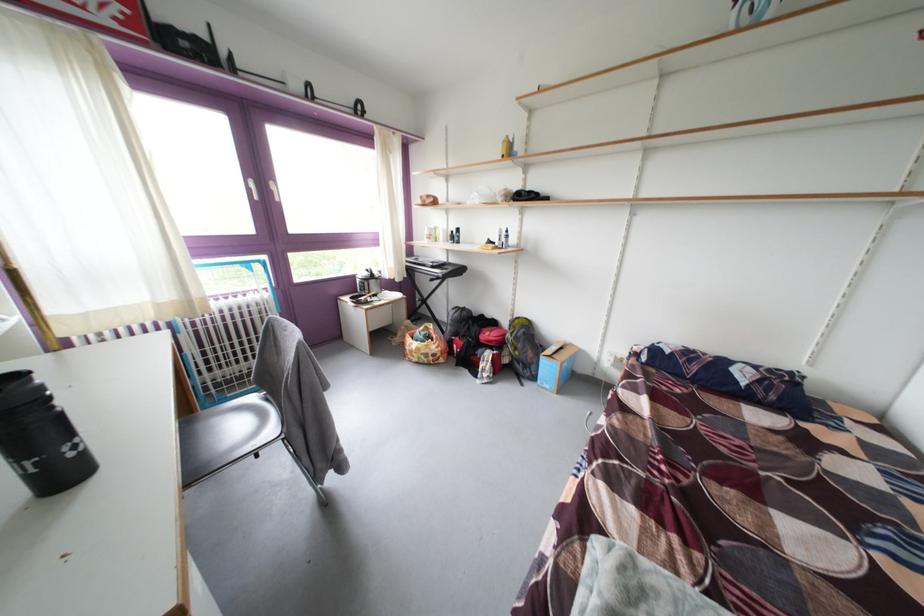
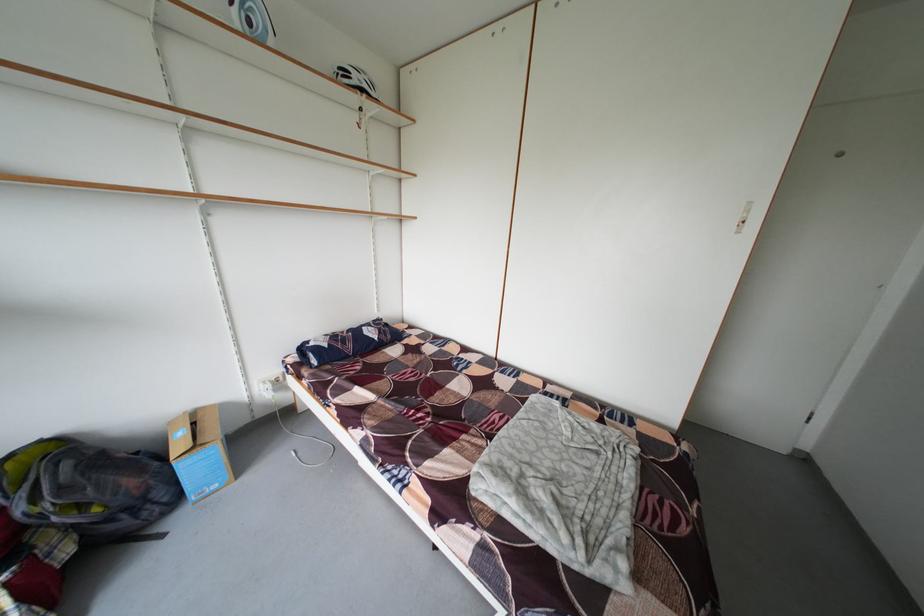
Find the pixel in the second image that matches point 568,347 in the first image.

(181, 428)